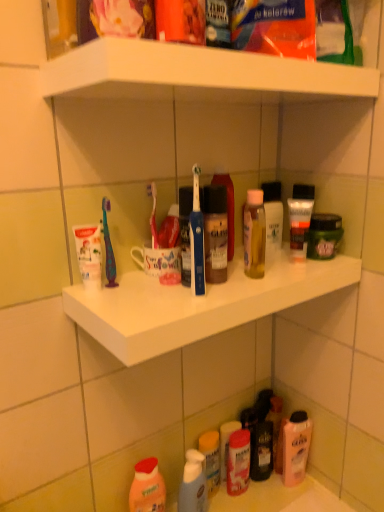
This screenshot has width=384, height=512. In order to click on vacant region in front of white matte toothpaste at left in this screenshot , I will do `click(109, 308)`.